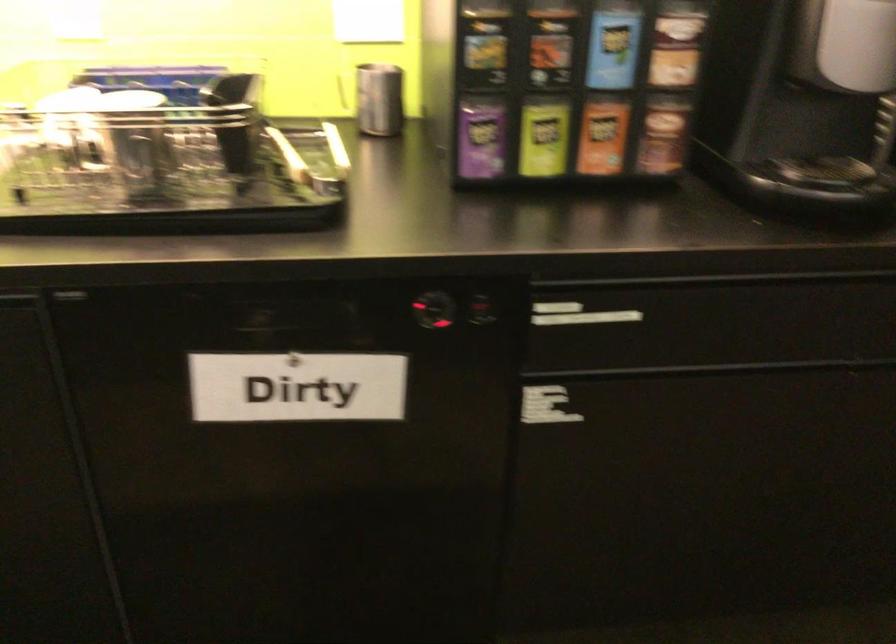
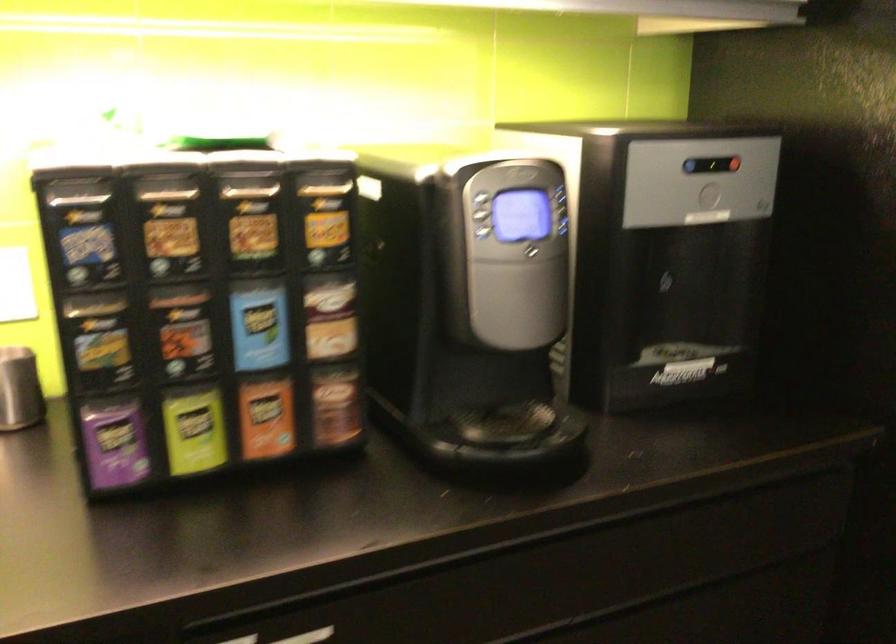
Find the pixel in the second image that matches point (623, 314) in the first image.

(308, 636)